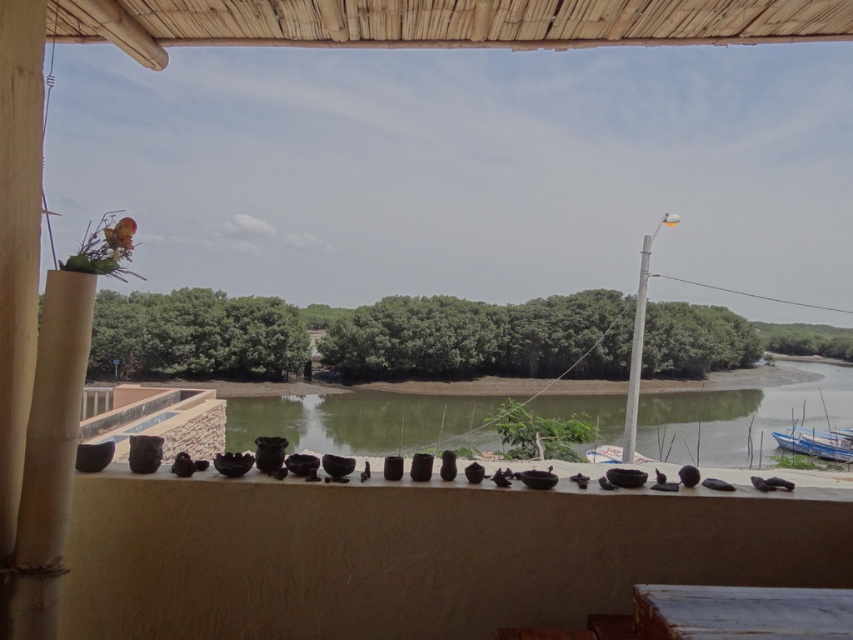
You are standing on the balcony and want to place a 3.5 meter long wooden bench between the two points marked as point (x=572, y=612) and another point. Will the bench fit without overlapping the low wall adorned with various black ceramic pots and bowls?

The distance between the two points is 3.49 meters. Since the bench is 3.5 meters long, it will not fit as it is slightly longer than the available space between them. The bench would overlap the low wall adorned with various black ceramic pots and bowls.

You are standing on the balcony and want to place a new decorative item between the matte black bowls at center and the blue painted wood boat at lower right. Based on their current positions, which object should the new item be closer to?

The new item should be placed closer to the blue painted wood boat at lower right because the matte black bowls at center is positioned on the left side of it.

You are standing on the balcony and want to place a new plant pot between the matte black bowls at center and the blue painted wood boat at lower right. Based on their positions, which object should the new pot be closer to?

The new pot should be placed closer to the blue painted wood boat at lower right because the matte black bowls at center are closer to the viewer, meaning the boat is further away, so placing the pot between them would require it to be nearer to the boat to maintain spatial order.